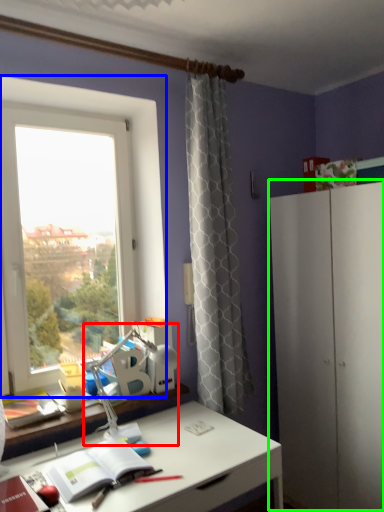
Question: Which object is the farthest from table lamp (highlighted by a red box)? Choose among these: window (highlighted by a blue box) or dresser (highlighted by a green box).

Choices:
 (A) window
 (B) dresser

Answer: (B)